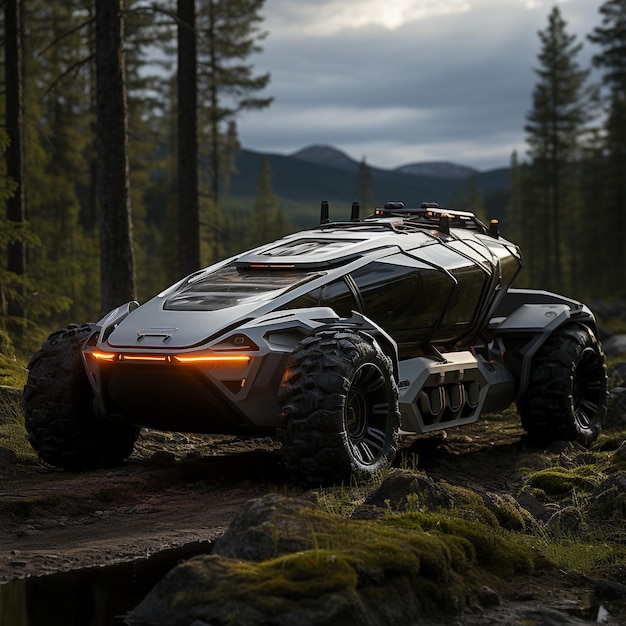
You are a GUI agent. You are given a task and a screenshot of the screen. Output one action in this format:
    pyautogui.click(x=<x>, y=<y>)
    Task: Click on the right lights
    This screenshot has width=626, height=626.
    Given the screenshot: What is the action you would take?
    pyautogui.click(x=106, y=357), pyautogui.click(x=146, y=357), pyautogui.click(x=203, y=356), pyautogui.click(x=287, y=372), pyautogui.click(x=240, y=381)